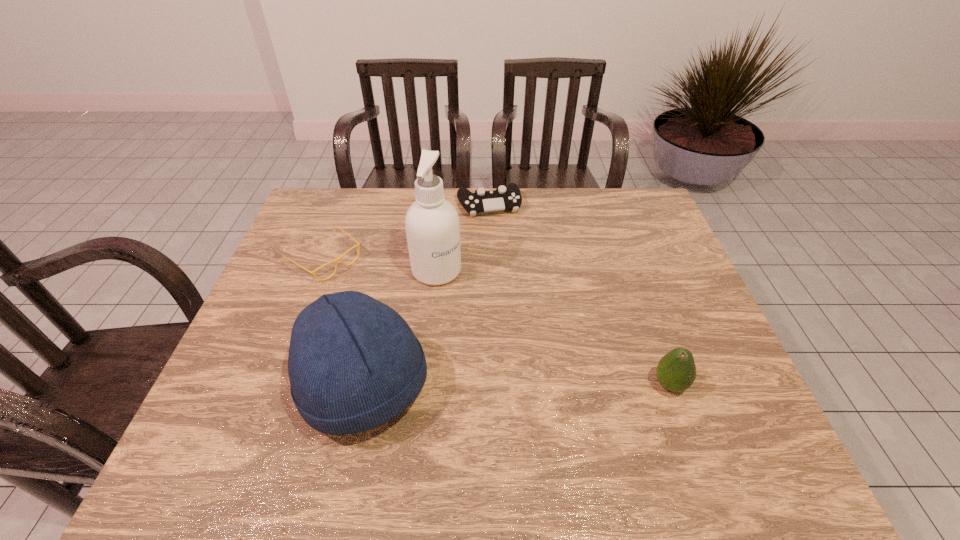
Where is `empty location between the tallest object and the farthest object`? This screenshot has width=960, height=540. empty location between the tallest object and the farthest object is located at coordinates (463, 238).

Locate an element on the screen. free spot between the cleansing agent and the fourth tallest object is located at coordinates [463, 238].

This screenshot has width=960, height=540. I want to click on empty location between the third shortest object and the second shortest object, so click(579, 295).

The width and height of the screenshot is (960, 540). Find the location of `unoccupied area between the third tallest object and the fourth tallest object`. unoccupied area between the third tallest object and the fourth tallest object is located at coordinates (579, 295).

Find the location of a particular element. free space between the rightmost object and the spectacles is located at coordinates (497, 322).

What are the coordinates of `free space between the avocado and the spectacles` in the screenshot? It's located at (497, 322).

Identify which object is located as the nearest to the avocado. Please provide its 2D coordinates. Your answer should be formatted as a tuple, i.e. [(x, y)], where the tuple contains the x and y coordinates of a point satisfying the conditions above.

[(354, 363)]

Choose which object is the fourth nearest neighbor to the shortest object. Please provide its 2D coordinates. Your answer should be formatted as a tuple, i.e. [(x, y)], where the tuple contains the x and y coordinates of a point satisfying the conditions above.

[(676, 371)]

Locate an element on the screen. Image resolution: width=960 pixels, height=540 pixels. vacant space that satisfies the following two spatial constraints: 1. on the back side of the spectacles; 2. on the left side of the second shortest object is located at coordinates click(346, 205).

Identify the location of vacant area that satisfies the following two spatial constraints: 1. on the back side of the shortest object; 2. on the left side of the fourth tallest object. The height and width of the screenshot is (540, 960). (346, 205).